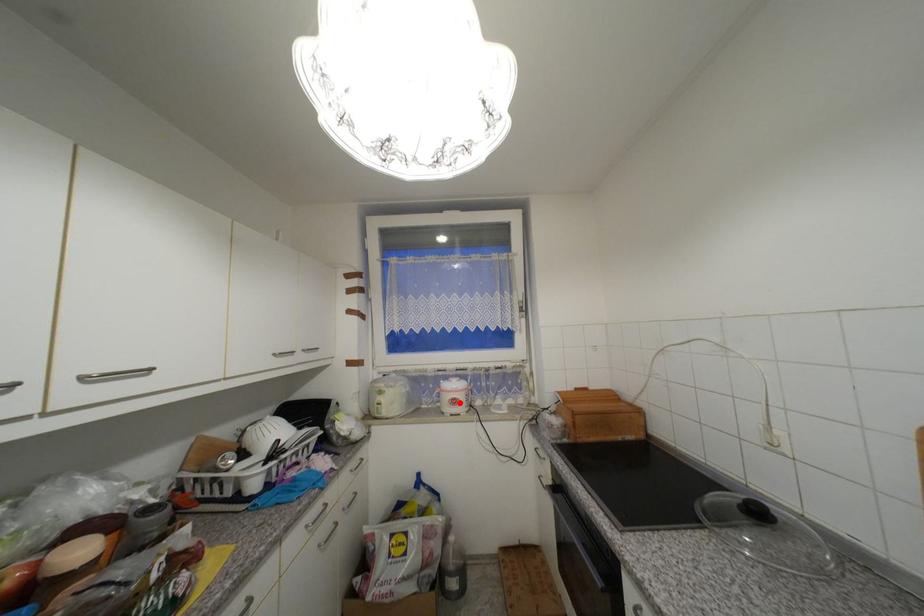
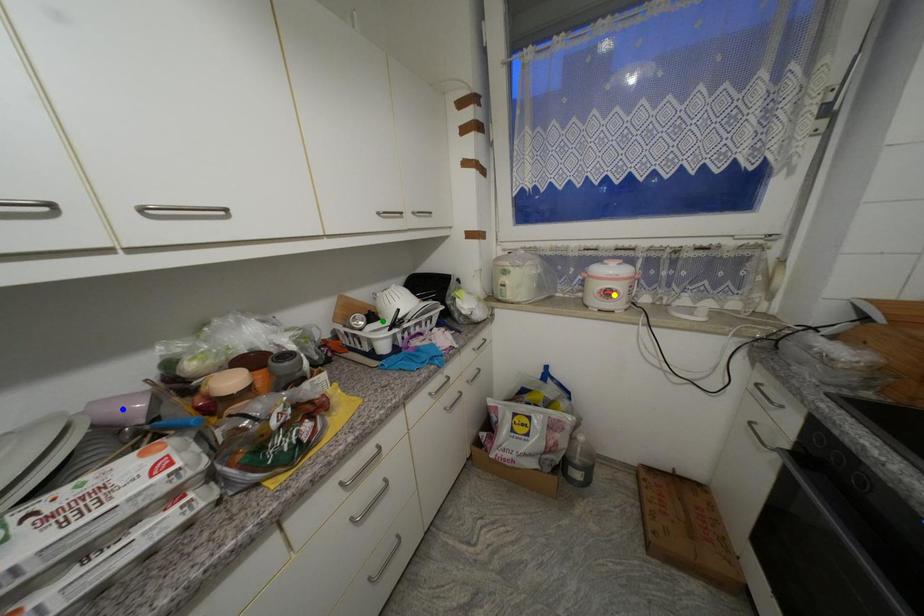
Question: I am providing you with two images of the same scene from different viewpoints. A red point is marked on the first image. You are given multiple points on the second image. Which point in image 2 is actually the same real-world point as the red point in image 1?

Choices:
 (A) blue point
 (B) yellow point
 (C) green point

Answer: (B)